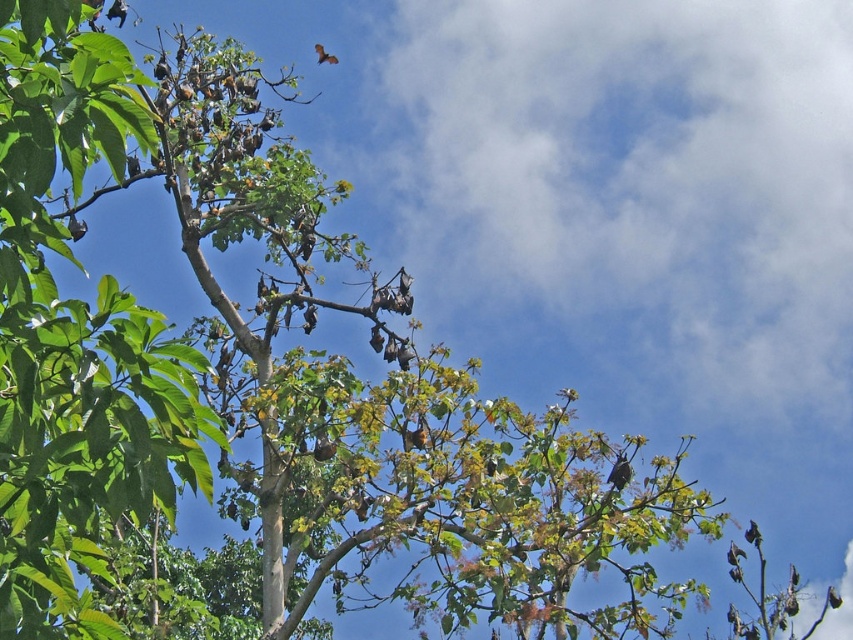
Between shiny black bird at center and brown furry bat at upper left, which one has more height?

shiny black bird at center

This screenshot has height=640, width=853. What are the coordinates of `shiny black bird at center` in the screenshot? It's located at (619, 472).

I want to click on shiny black bird at center, so click(619, 472).

How distant is brown furry bat at upper left from brown matte bat at upper center?

brown furry bat at upper left and brown matte bat at upper center are 4.38 meters apart from each other.

Between point (79, 236) and point (331, 54), which one is positioned in front?

Point (79, 236) is more forward.

The height and width of the screenshot is (640, 853). I want to click on brown furry bat at upper left, so click(76, 227).

Is shiny black bird at center further to the viewer compared to brown furry bat at lower right?

No, it is in front of brown furry bat at lower right.

Is point (613, 467) closer to camera compared to point (728, 550)?

That is True.

Does point (628, 465) come closer to viewer compared to point (737, 557)?

Yes, point (628, 465) is in front of point (737, 557).

The width and height of the screenshot is (853, 640). Identify the location of shiny black bird at center. (619, 472).